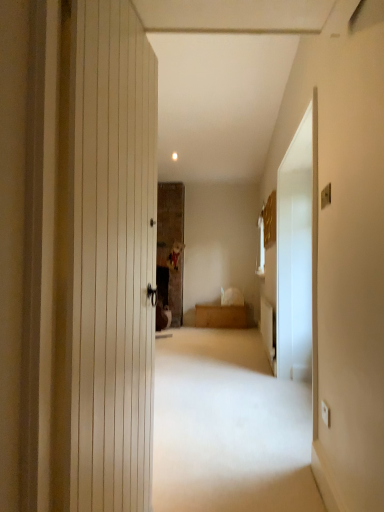
Question: Are wooden chest at center and transparent glass screen door at right beside each other?

Choices:
 (A) yes
 (B) no

Answer: (B)

Question: Does wooden chest at center have a greater height compared to transparent glass screen door at right?

Choices:
 (A) no
 (B) yes

Answer: (A)

Question: Is transparent glass screen door at right inside wooden chest at center?

Choices:
 (A) no
 (B) yes

Answer: (A)

Question: Can you confirm if wooden chest at center is positioned to the right of transparent glass screen door at right?

Choices:
 (A) no
 (B) yes

Answer: (A)

Question: From the image's perspective, is wooden chest at center on top of transparent glass screen door at right?

Choices:
 (A) no
 (B) yes

Answer: (A)

Question: Is wooden chest at center closer to the viewer compared to transparent glass screen door at right?

Choices:
 (A) yes
 (B) no

Answer: (B)

Question: Is transparent glass screen door at right with wooden chest at center?

Choices:
 (A) no
 (B) yes

Answer: (A)

Question: Can you confirm if transparent glass screen door at right is positioned to the left of wooden chest at center?

Choices:
 (A) no
 (B) yes

Answer: (A)

Question: From a real-world perspective, is transparent glass screen door at right positioned under wooden chest at center based on gravity?

Choices:
 (A) yes
 (B) no

Answer: (B)

Question: Can you confirm if transparent glass screen door at right is thinner than wooden chest at center?

Choices:
 (A) no
 (B) yes

Answer: (B)

Question: Would you say transparent glass screen door at right contains wooden chest at center?

Choices:
 (A) yes
 (B) no

Answer: (B)

Question: Is transparent glass screen door at right positioned in front of wooden chest at center?

Choices:
 (A) yes
 (B) no

Answer: (A)

Question: In the image, is wooden chest at center positioned in front of or behind transparent glass screen door at right?

Choices:
 (A) front
 (B) behind

Answer: (B)